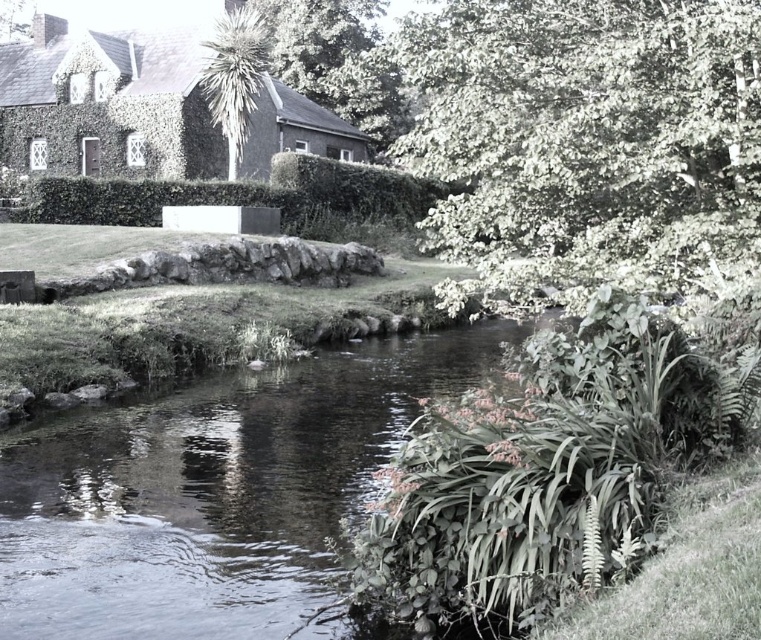
You are a landscape architect designing a walking path that must pass between the green leafy tree at upper right and the green leafy tree at upper center. Given that the path needs to be at least 2 meters wide to accommodate visitors comfortably, can the existing space between these two trees support this requirement?

The green leafy tree at upper right has a larger width than the green leafy tree at upper center. However, the exact distance between them isn

You are a hiker who wants to cross the stream using a 5 meter long wooden plank. You see the clear water at center and the green leafy tree at upper right. Can you safely place the plank between them to cross?

The clear water at center is 4.53 meters from the green leafy tree at upper right. Since the plank is 5 meters long, it can span the distance, so you can safely place the plank between them to cross.

You are an environmental scientist assessing the ecosystem of this stream. You notice the clear water at center and the green leafy tree at upper center. Which of these two features occupies a larger area in the scene?

The green leafy tree at upper center occupies a larger area than the clear water at center.